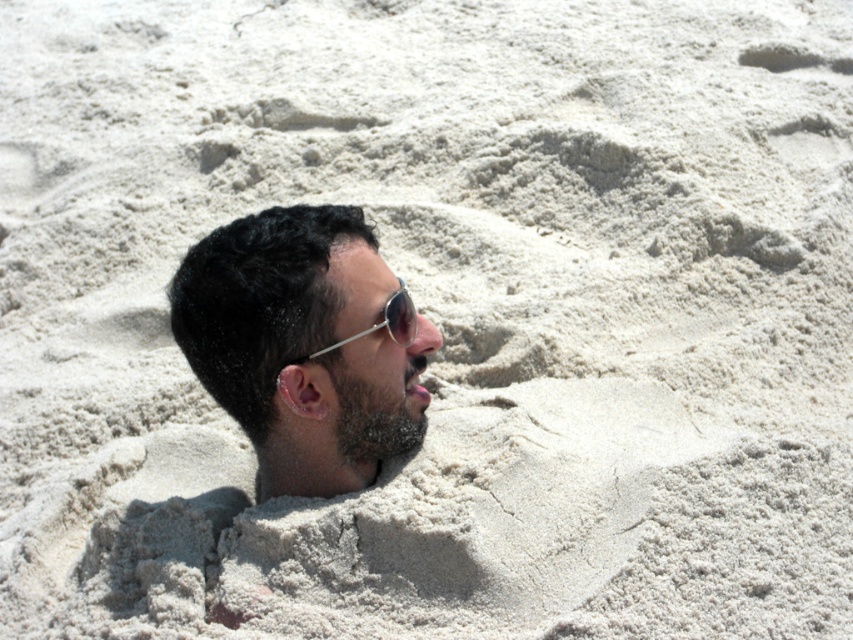
Question: Which of the following is the closest to the observer?

Choices:
 (A) metallic reflective sunglasses at center
 (B) dark brown hair at center

Answer: (B)

Question: Is dark brown hair at center smaller than metallic reflective sunglasses at center?

Choices:
 (A) no
 (B) yes

Answer: (A)

Question: From the image, what is the correct spatial relationship of dark brown hair at center in relation to metallic reflective sunglasses at center?

Choices:
 (A) left
 (B) right

Answer: (A)

Question: Does dark brown hair at center have a larger size compared to metallic reflective sunglasses at center?

Choices:
 (A) yes
 (B) no

Answer: (A)